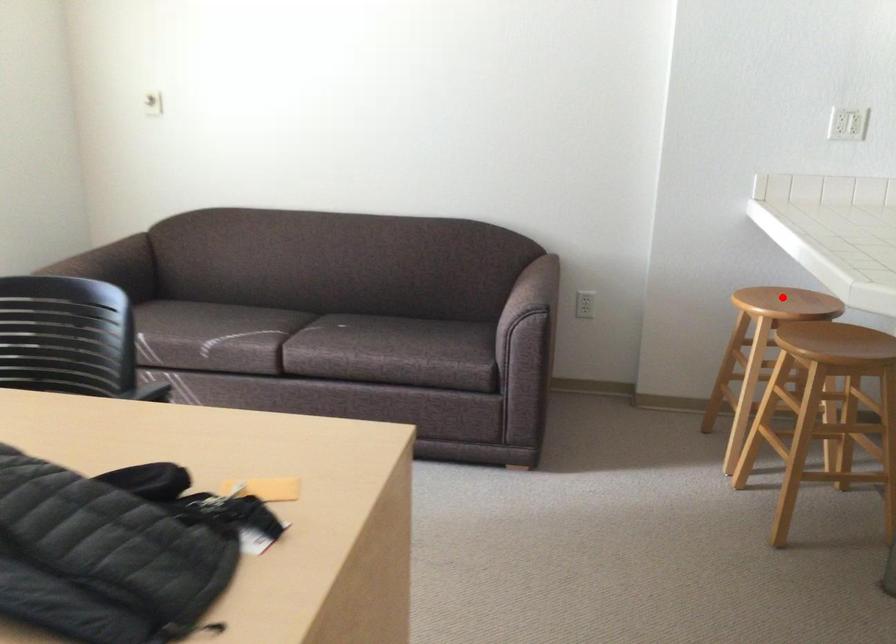
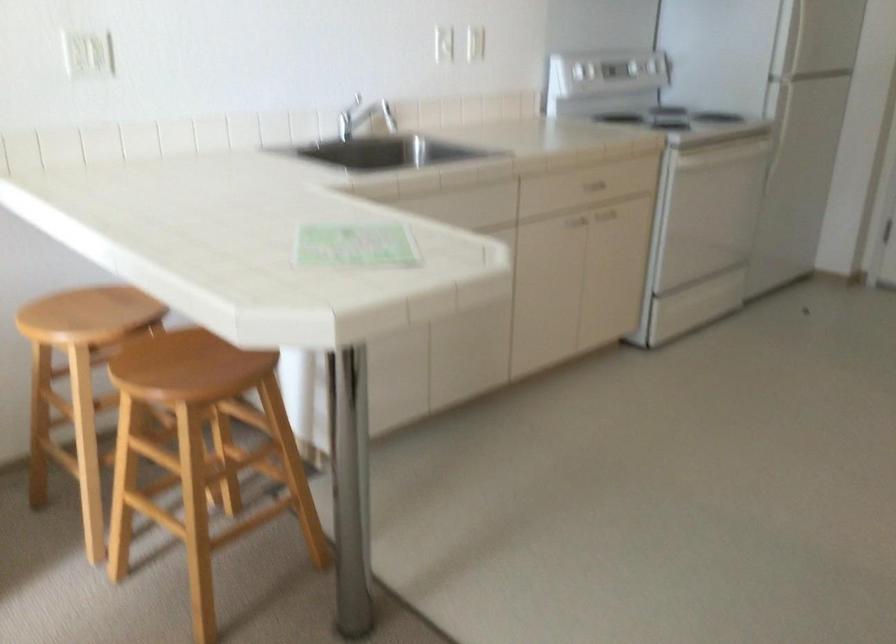
Question: I am providing you with two images of the same scene from different viewpoints. In image1, a red point is highlighted. Considering the same 3D point in image2, which of the following is correct?

Choices:
 (A) It is closer
 (B) It is farther

Answer: (A)